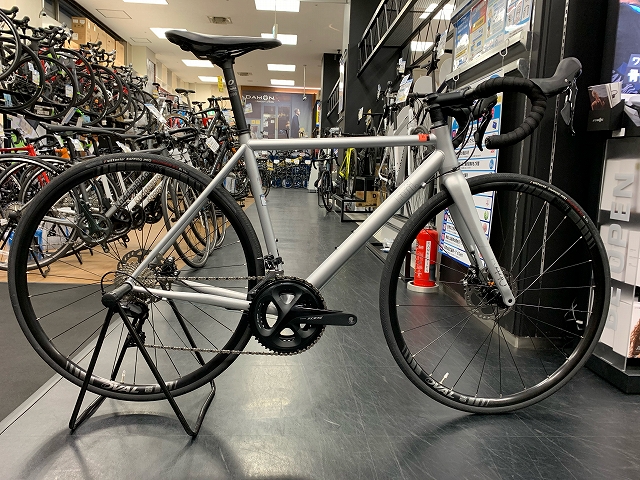
At what (x,y) coordinates should I click in order to perform the action: click on fire extinguisher. Please return your answer as a coordinate pair (x, y). Image resolution: width=640 pixels, height=480 pixels. Looking at the image, I should click on (429, 249).